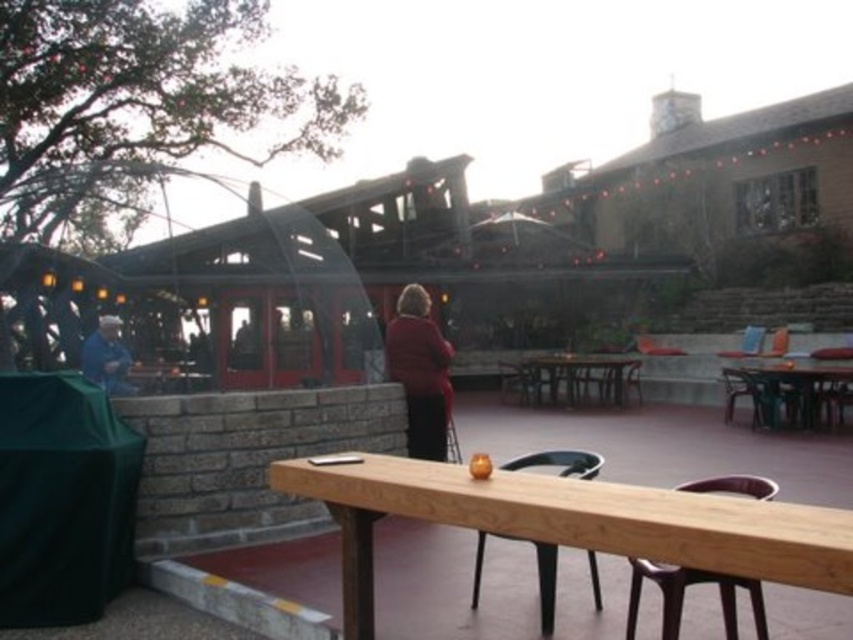
Question: Is wooden picnic table at center above blue fabric at left?

Choices:
 (A) no
 (B) yes

Answer: (A)

Question: Which of the following is the farthest from the observer?

Choices:
 (A) blue fabric at left
 (B) natural wood table at center
 (C) wooden picnic table at center

Answer: (C)

Question: Which point is closer to the camera?

Choices:
 (A) natural wood table at center
 (B) blue fabric at left
 (C) wooden picnic table at center

Answer: (A)

Question: Which point is closer to the camera?

Choices:
 (A) natural wood table at center
 (B) wooden picnic table at center
 (C) matte red coat at center

Answer: (A)

Question: Is matte red coat at center to the right of wooden picnic table at right from the viewer's perspective?

Choices:
 (A) no
 (B) yes

Answer: (A)

Question: Does natural wood table at center appear on the right side of wooden picnic table at right?

Choices:
 (A) yes
 (B) no

Answer: (B)